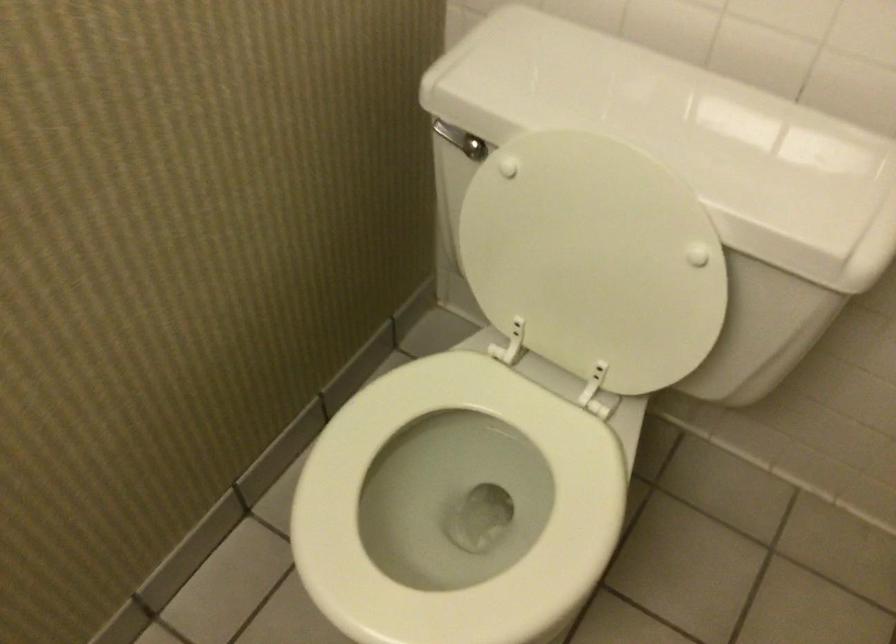
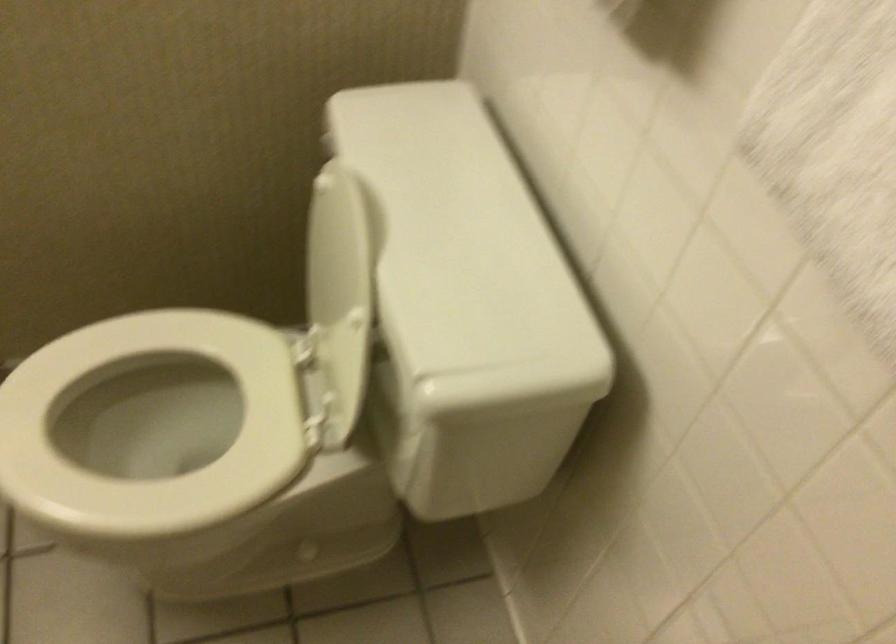
Question: The first image is from the beginning of the video and the second image is from the end. How did the camera likely rotate when shooting the video?

Choices:
 (A) Left
 (B) Right
 (C) Up
 (D) Down

Answer: (A)